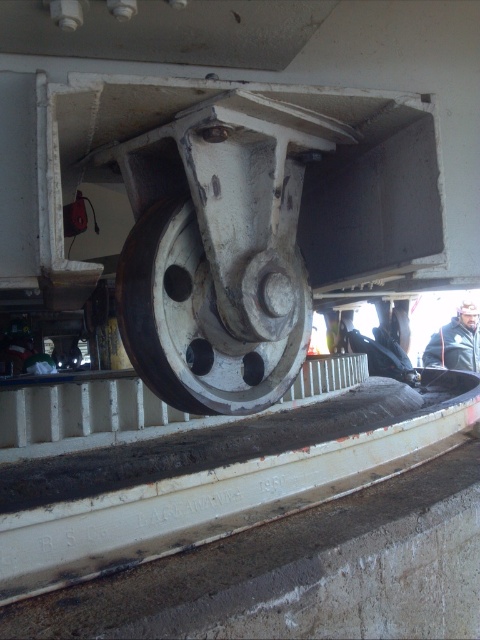
Who is more forward, (228, 346) or (458, 369)?

Point (228, 346) is in front.

The width and height of the screenshot is (480, 640). Describe the element at coordinates (195, 323) in the screenshot. I see `white matte wheel at center` at that location.

The image size is (480, 640). I want to click on white matte wheel at center, so click(x=195, y=323).